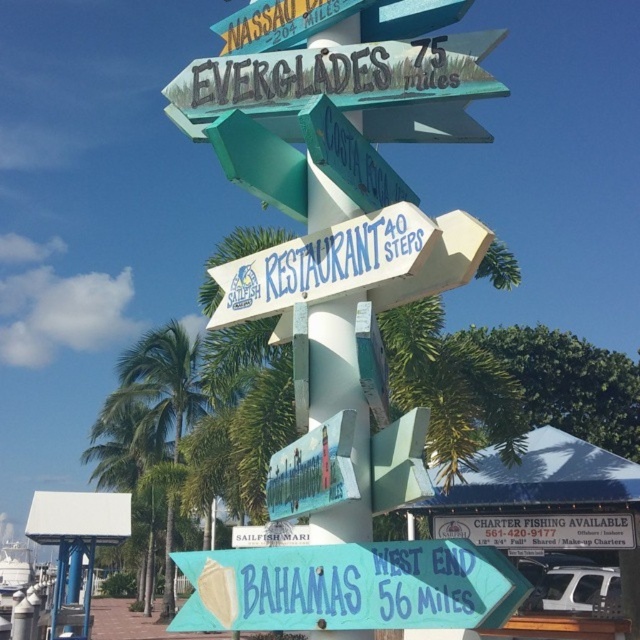
Consider the image. Is green painted wooden signpost at upper center above white plastic sign at lower center?

Yes, green painted wooden signpost at upper center is above white plastic sign at lower center.

Is point (390, 72) more distant than point (602, 525)?

No.

You are a GUI agent. You are given a task and a screenshot of the screen. Output one action in this format:
    pyautogui.click(x=<x>, y=<y>)
    Task: Click on the green painted wooden signpost at upper center
    
    Given the screenshot: What is the action you would take?
    pyautogui.click(x=337, y=76)

Which is more to the right, green leafy palm tree at left or white plastic sign at lower center?

white plastic sign at lower center

Which is in front, point (136, 436) or point (506, 541)?

Positioned in front is point (506, 541).

This screenshot has width=640, height=640. I want to click on green leafy palm tree at left, so click(x=161, y=387).

Locate an element on the screen. Image resolution: width=640 pixels, height=640 pixels. green painted wooden signpost at upper center is located at coordinates (337, 76).

Who is higher up, green painted wooden signpost at upper center or green leafy palm tree at left?

green painted wooden signpost at upper center is higher up.

Does point (376, 90) lie behind point (147, 397)?

No, it is in front of (147, 397).

Where is `green painted wooden signpost at upper center`? green painted wooden signpost at upper center is located at coordinates (337, 76).